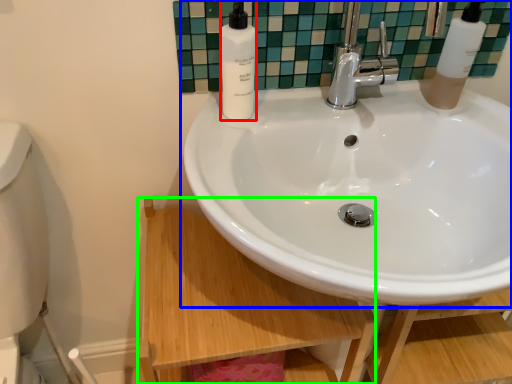
Question: Which object is the farthest from soap dispenser (highlighted by a red box)? Choose among these: sink (highlighted by a blue box) or counter top (highlighted by a green box).

Choices:
 (A) sink
 (B) counter top

Answer: (B)